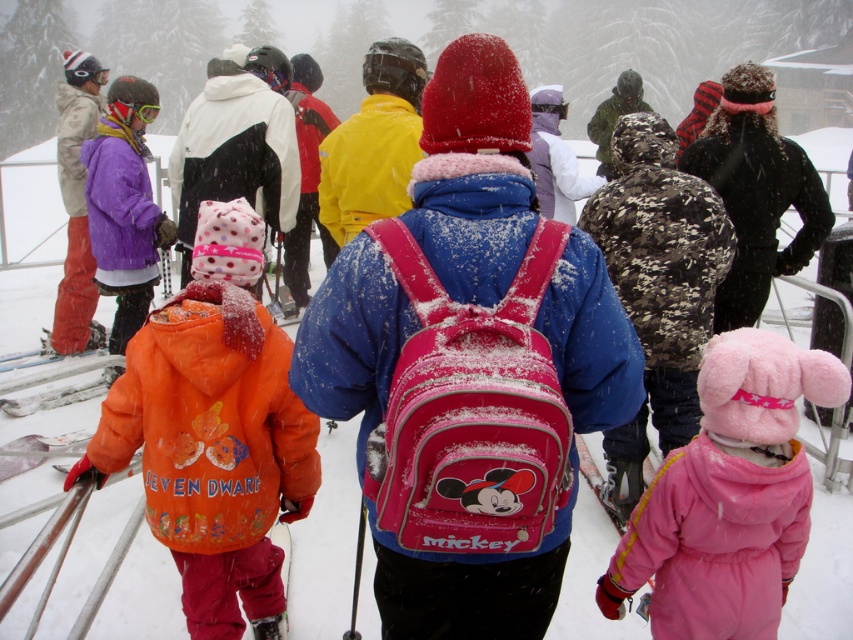
Question: Which point is farther to the camera?

Choices:
 (A) pink fabric backpack at center
 (B) purple fleece jacket at left

Answer: (B)

Question: Can you confirm if pink fabric backpack at center is bigger than pink fluffy snowsuit at lower right?

Choices:
 (A) yes
 (B) no

Answer: (A)

Question: Does pink fluffy snowsuit at lower right have a larger size compared to white plastic ski at lower left?

Choices:
 (A) no
 (B) yes

Answer: (A)

Question: Is pink fabric backpack at center to the right of pink fluffy snowsuit at lower right from the viewer's perspective?

Choices:
 (A) yes
 (B) no

Answer: (B)

Question: Among these points, which one is nearest to the camera?

Choices:
 (A) (64, 369)
 (B) (763, 260)
 (C) (334, 342)
 (D) (134, 88)

Answer: (C)

Question: Which object is the farthest from the orange fleece jacket at center?

Choices:
 (A) white plastic ski at lower left
 (B) purple fleece jacket at left
 (C) black matte jacket at upper center

Answer: (C)